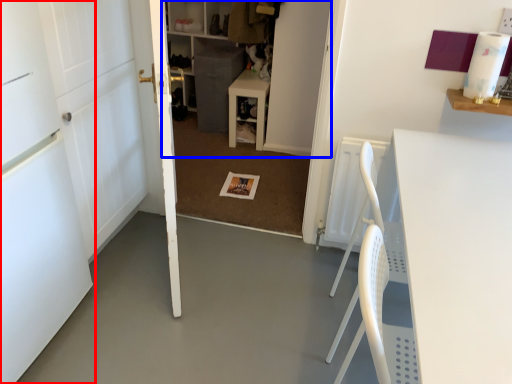
Question: Among these objects, which one is nearest to the camera, door (highlighted by a red box) or bookshelf (highlighted by a blue box)?

Choices:
 (A) door
 (B) bookshelf

Answer: (A)